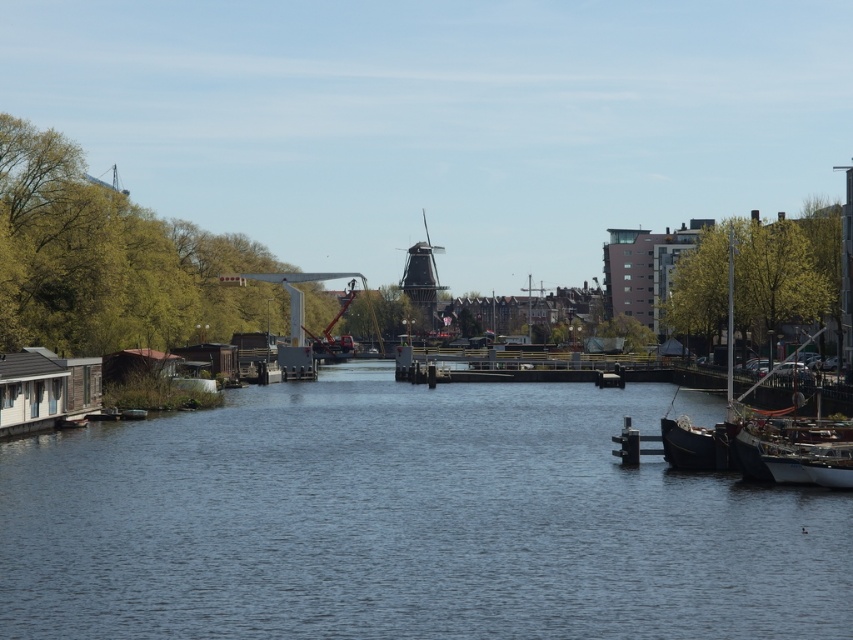
Which is behind, point (814, 522) or point (726, 396)?

The point (726, 396) is behind.

Is the position of blue water at center less distant than that of dark brown wooden boat at right?

Yes.

Which is behind, point (256, 520) or point (730, 435)?

Point (730, 435)

The height and width of the screenshot is (640, 853). In order to click on blue water at center in this screenshot , I will do `click(405, 522)`.